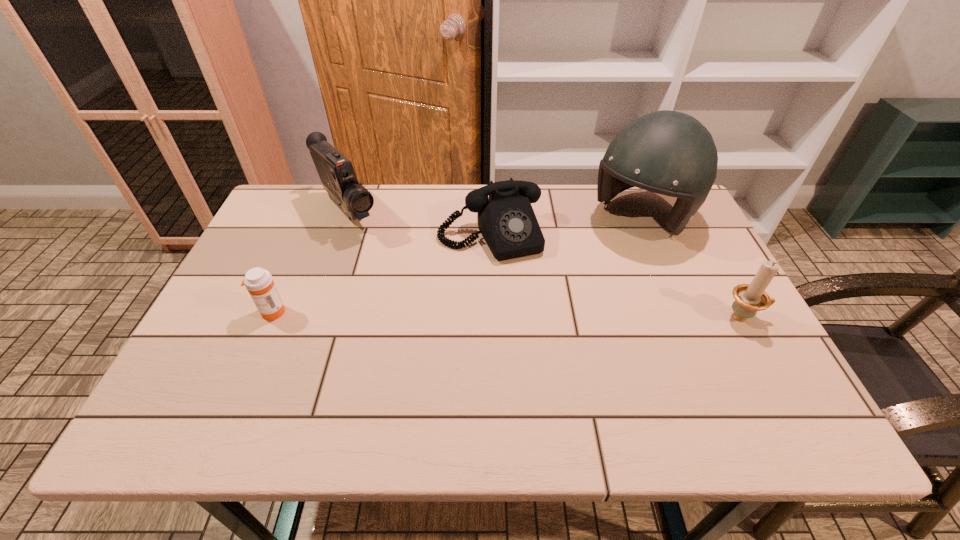
Where is `vacant space on the desktop that is between the medicine and the third tallest object and is positioned on the dial of the telephone`? vacant space on the desktop that is between the medicine and the third tallest object and is positioned on the dial of the telephone is located at coordinates (525, 315).

Where is `vacant space on the desktop that is between the medicine and the candle_holder and is positioned at the face opening of the tallest object`? This screenshot has width=960, height=540. vacant space on the desktop that is between the medicine and the candle_holder and is positioned at the face opening of the tallest object is located at coordinates (544, 315).

Identify the location of vacant spot on the desktop that is between the medicine and the third shortest object and is positioned on the front-facing side of the camcorder. (441, 314).